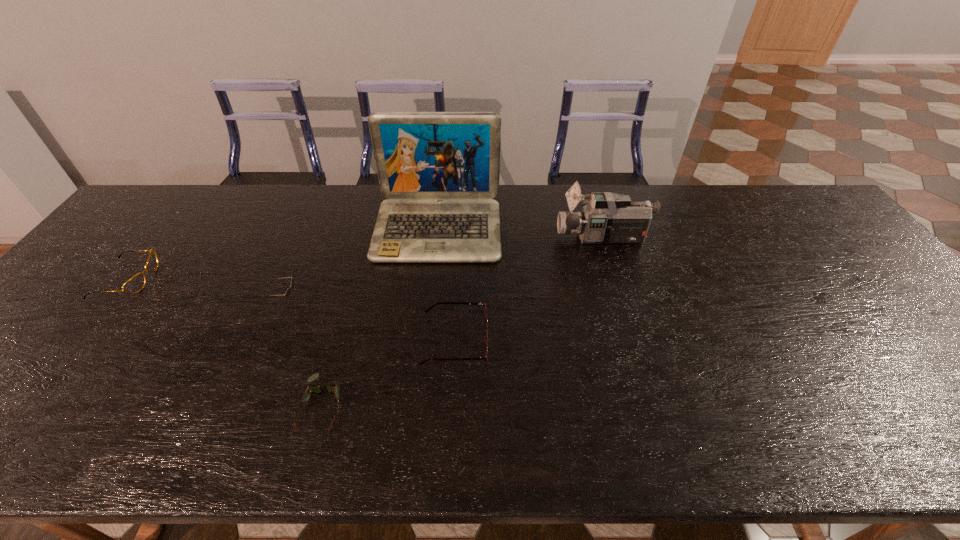
Find the location of a particular element. The height and width of the screenshot is (540, 960). vacant space located on the screen of the laptop computer is located at coordinates (424, 359).

At what (x,y) coordinates should I click in order to perform the action: click on vacant region located on the front-facing side of the fifth shortest object. Please return your answer as a coordinate pair (x, y). Image resolution: width=960 pixels, height=540 pixels. Looking at the image, I should click on (531, 238).

Where is `free space located on the front-facing side of the fifth shortest object`? Image resolution: width=960 pixels, height=540 pixels. free space located on the front-facing side of the fifth shortest object is located at coordinates (448, 238).

Where is `free spot located 0.110m on the front-facing side of the fifth shortest object`? The width and height of the screenshot is (960, 540). free spot located 0.110m on the front-facing side of the fifth shortest object is located at coordinates (521, 238).

I want to click on vacant area situated in front of the lenses of the sunglasses, so click(332, 301).

Where is `vacant space situated 0.260m on the front-facing side of the leftmost spectacles`? The height and width of the screenshot is (540, 960). vacant space situated 0.260m on the front-facing side of the leftmost spectacles is located at coordinates (246, 279).

Locate an element on the screen. The image size is (960, 540). free point located on the lenses of the second nearest spectacles is located at coordinates (596, 341).

Locate an element on the screen. This screenshot has width=960, height=540. laptop computer at the far edge is located at coordinates (439, 170).

I want to click on camcorder present at the far edge, so click(607, 218).

You are a GUI agent. You are given a task and a screenshot of the screen. Output one action in this format:
    pyautogui.click(x=<x>, y=<y>)
    Task: Click on the object that is at the near edge
    Image resolution: width=960 pixels, height=540 pixels.
    Given the screenshot: What is the action you would take?
    coord(332,388)